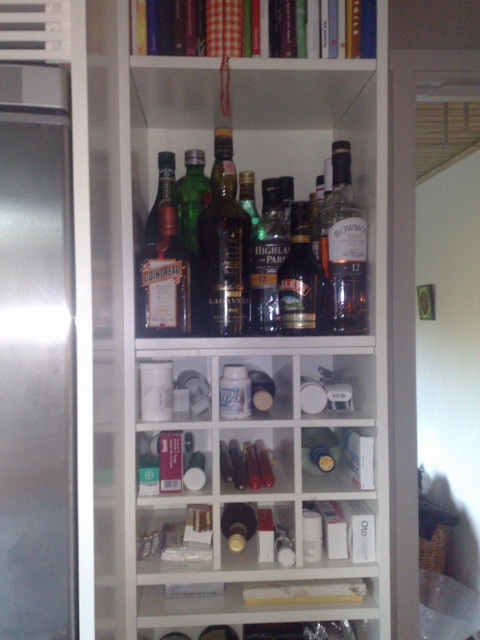
Question: Observing the image, what is the correct spatial positioning of clear plastic bottles at center in reference to matte glass bottle at center-left?

Choices:
 (A) above
 (B) below

Answer: (B)

Question: Considering the real-world distances, which object is closest to the matte glass bottles at center?

Choices:
 (A) shiny dark green bottle at center
 (B) matte glass bottle at upper right
 (C) translucent amber bottle at center

Answer: (A)

Question: Among these points, which one is farthest from the camera?

Choices:
 (A) (217, 218)
 (B) (186, 109)
 (C) (311, 326)
 (D) (255, 228)

Answer: (B)

Question: Estimate the real-world distances between objects in this image. Which object is closer to the translucent amber bottle at center?

Choices:
 (A) matte glass bottle at upper right
 (B) translucent glass bottle at center

Answer: (A)

Question: Is shiny dark green bottle at center to the right of matte glass bottle at upper right from the viewer's perspective?

Choices:
 (A) no
 (B) yes

Answer: (A)

Question: Is matte glass bottles at center positioned at the back of translucent amber bottle at center?

Choices:
 (A) no
 (B) yes

Answer: (A)